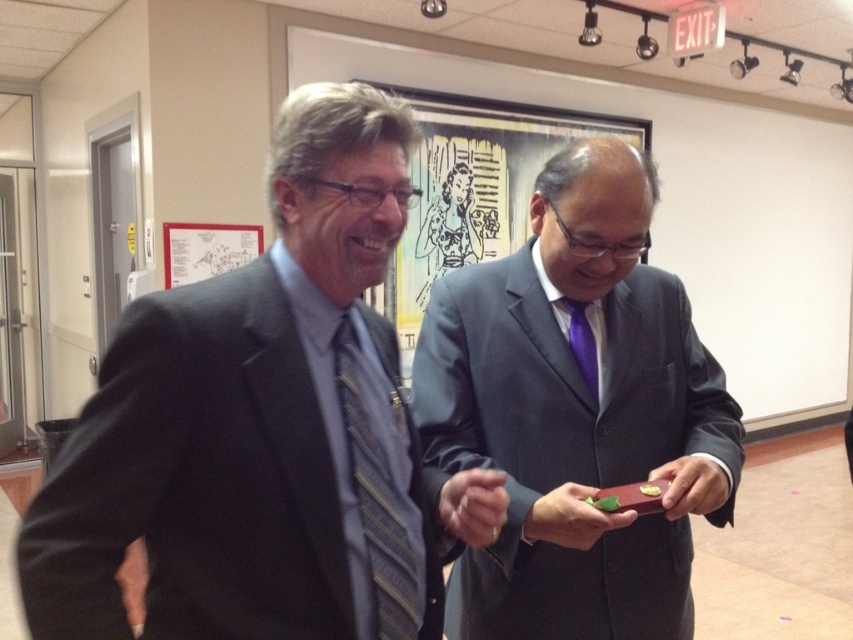
Question: Which of these objects is positioned farthest from the purple satin tie at center?

Choices:
 (A) striped fabric tie at center
 (B) matte purple tie at center
 (C) matte gray suit at left

Answer: (C)

Question: Which object is the farthest from the matte black framed artwork at center?

Choices:
 (A) striped fabric tie at center
 (B) matte purple tie at center
 (C) purple satin tie at center

Answer: (A)

Question: Is matte purple tie at center thinner than purple satin tie at center?

Choices:
 (A) no
 (B) yes

Answer: (A)

Question: Which of the following is the closest to the observer?

Choices:
 (A) (585, 326)
 (B) (447, 260)

Answer: (A)

Question: Can you confirm if matte purple tie at center is bigger than striped fabric tie at center?

Choices:
 (A) yes
 (B) no

Answer: (A)

Question: Does matte gray suit at left have a smaller size compared to striped fabric tie at center?

Choices:
 (A) no
 (B) yes

Answer: (A)